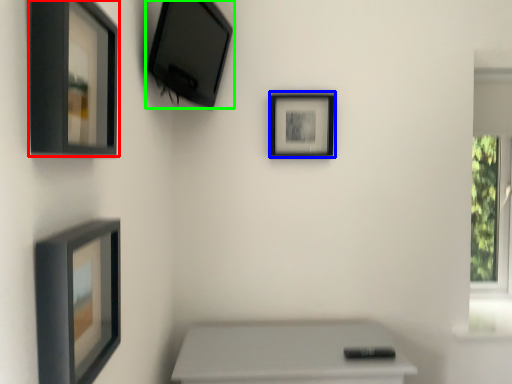
Question: Which object is positioned farthest from picture frame (highlighted by a red box)? Select from picture frame (highlighted by a blue box) and picture frame (highlighted by a green box).

Choices:
 (A) picture frame
 (B) picture frame

Answer: (A)